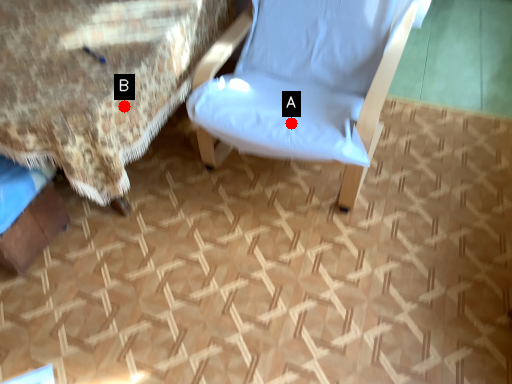
Question: Two points are circled on the image, labeled by A and B beside each circle. Among these points, which one is nearest to the camera?

Choices:
 (A) A is closer
 (B) B is closer

Answer: (B)